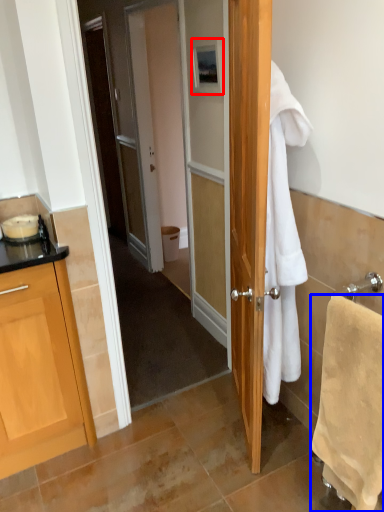
Question: Which object is closer to the camera taking this photo, picture frame (highlighted by a red box) or towel/napkin (highlighted by a blue box)?

Choices:
 (A) picture frame
 (B) towel/napkin

Answer: (B)